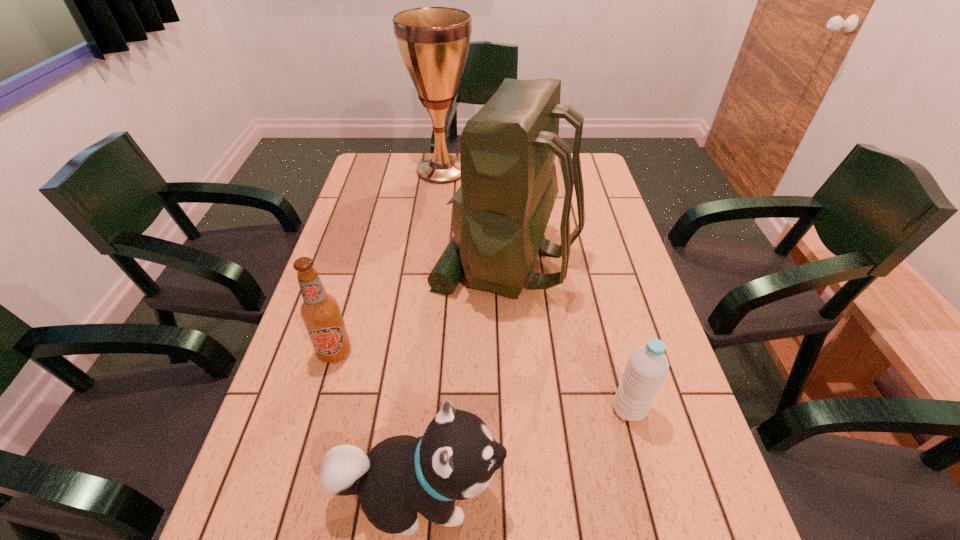
Identify the location of blank region between the second nearest object and the third farthest object. This screenshot has width=960, height=540. (482, 381).

Identify which object is located as the third nearest to the trophy cup. Please provide its 2D coordinates. Your answer should be formatted as a tuple, i.e. [(x, y)], where the tuple contains the x and y coordinates of a point satisfying the conditions above.

[(647, 367)]

Locate which object is the closest to the puppy. Please provide its 2D coordinates. Your answer should be formatted as a tuple, i.e. [(x, y)], where the tuple contains the x and y coordinates of a point satisfying the conditions above.

[(320, 312)]

You are a GUI agent. You are given a task and a screenshot of the screen. Output one action in this format:
    pyautogui.click(x=<x>, y=<y>)
    Task: Click on the free spot that satisfies the following two spatial constraints: 1. on the front label of the water bottle; 2. on the left side of the third nearest object
    This screenshot has height=540, width=960.
    Given the screenshot: What is the action you would take?
    pyautogui.click(x=319, y=409)

Find the location of a particular element. Image resolution: width=960 pixels, height=540 pixels. vacant space that satisfies the following two spatial constraints: 1. on the front of the fourth farthest object with visible pockets; 2. on the left side of the backpack is located at coordinates (514, 409).

Where is `blank area in the image that satisfies the following two spatial constraints: 1. on the back side of the water bottle; 2. on the front of the backpack with visible pockets`? This screenshot has height=540, width=960. blank area in the image that satisfies the following two spatial constraints: 1. on the back side of the water bottle; 2. on the front of the backpack with visible pockets is located at coordinates (589, 261).

At what (x,y) coordinates should I click in order to perform the action: click on free space in the image that satisfies the following two spatial constraints: 1. on the back side of the water bottle; 2. on the front of the backpack with visible pockets. Please return your answer as a coordinate pair (x, y). Image resolution: width=960 pixels, height=540 pixels. Looking at the image, I should click on (589, 261).